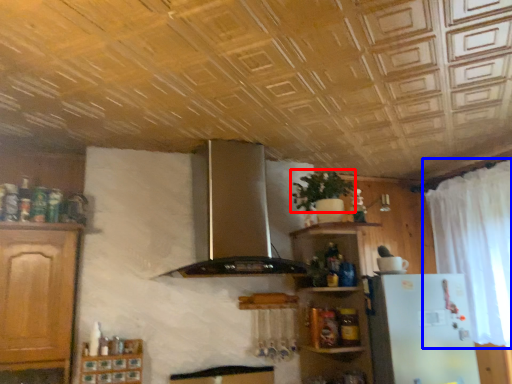
Question: Which object is further to the camera taking this photo, plant (highlighted by a red box) or curtain (highlighted by a blue box)?

Choices:
 (A) plant
 (B) curtain

Answer: (A)